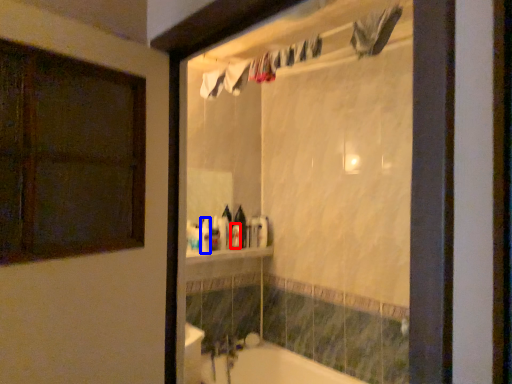
Question: Which of the following is the closest to the observer, toiletry (highlighted by a red box) or toiletry (highlighted by a blue box)?

Choices:
 (A) toiletry
 (B) toiletry

Answer: (B)